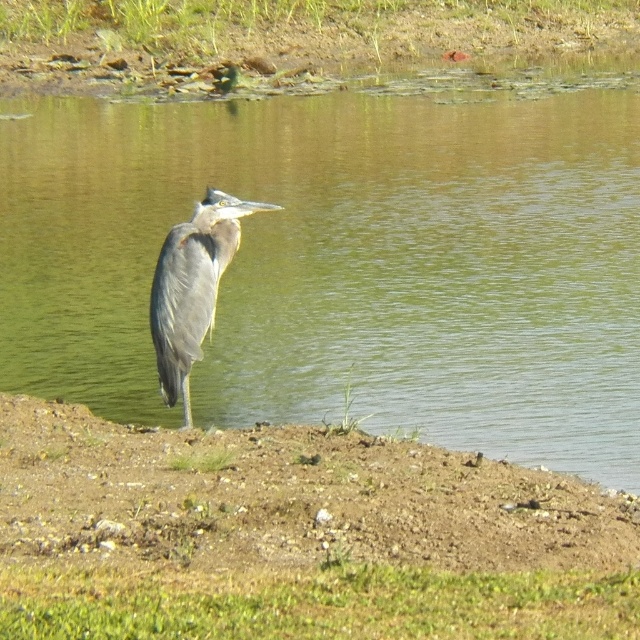
Question: Which of the following is the closest to the observer?

Choices:
 (A) (269, 106)
 (B) (225, 259)
 (C) (141, 476)

Answer: (C)

Question: From the image, what is the correct spatial relationship of greenish water at center in relation to gray feathered heron at center?

Choices:
 (A) above
 (B) below

Answer: (A)

Question: Observing the image, what is the correct spatial positioning of dull brown dirt at lower center in reference to gray feathered heron at center?

Choices:
 (A) above
 (B) below

Answer: (B)

Question: Does greenish water at center have a lesser width compared to dull brown dirt at lower center?

Choices:
 (A) no
 (B) yes

Answer: (A)

Question: Which object appears closest to the camera in this image?

Choices:
 (A) gray feathered heron at center
 (B) greenish water at center
 (C) dull brown dirt at lower center

Answer: (C)

Question: Which point is closer to the camera taking this photo?

Choices:
 (A) (227, 545)
 (B) (273, 140)

Answer: (A)